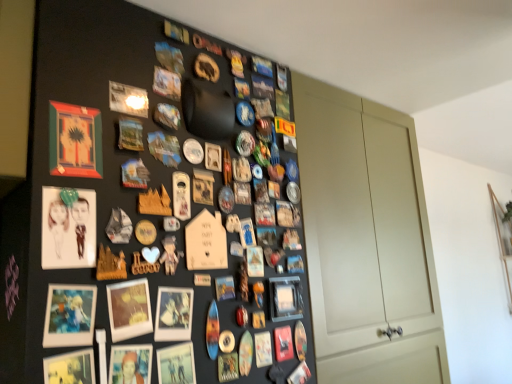
Describe the element at coordinates (75, 141) in the screenshot. I see `matte wooden picture frame at upper left, arranged as the first picture frame when viewed from the left` at that location.

Locate an element on the screen. matte wooden picture frame at upper left, arranged as the eighth picture frame when viewed from the right is located at coordinates (75, 141).

The width and height of the screenshot is (512, 384). Describe the element at coordinates (70, 315) in the screenshot. I see `matte plastic picture frame at lower left, which appears as the 6th picture frame when viewed from the right` at that location.

This screenshot has width=512, height=384. Find the location of `matte wooden picture frame at upper left, arranged as the eighth picture frame when viewed from the right`. matte wooden picture frame at upper left, arranged as the eighth picture frame when viewed from the right is located at coordinates pos(75,141).

Can you confirm if matte plastic picture frame at lower left, the 3th picture frame positioned from the left, is smaller than matte paper picture frame at left, the 7th picture frame in the right-to-left sequence?

Correct, matte plastic picture frame at lower left, the 3th picture frame positioned from the left, occupies less space than matte paper picture frame at left, the 7th picture frame in the right-to-left sequence.

Is matte paper picture frame at left, the 7th picture frame in the right-to-left sequence, inside matte plastic picture frame at lower left, which appears as the 6th picture frame when viewed from the right?

No, matte paper picture frame at left, the 7th picture frame in the right-to-left sequence, is not surrounded by matte plastic picture frame at lower left, which appears as the 6th picture frame when viewed from the right.

From the image's perspective, which picture frame is the 1st one below the matte paper picture frame at left, which is counted as the 2th picture frame, starting from the left? Please provide its 2D coordinates.

[(70, 315)]

In the scene shown: Is matte plastic picture frame at lower left, acting as the sixth picture frame starting from the left, not inside matte plastic picture frame at lower left, the 3th picture frame positioned from the left?

matte plastic picture frame at lower left, acting as the sixth picture frame starting from the left, lies outside matte plastic picture frame at lower left, the 3th picture frame positioned from the left,'s area.

From a real-world perspective, is matte plastic picture frame at lower left, which appears as the third picture frame when viewed from the right, positioned under matte plastic picture frame at lower left, the 3th picture frame positioned from the left, based on gravity?

Correct, in the physical world, matte plastic picture frame at lower left, which appears as the third picture frame when viewed from the right, is lower than matte plastic picture frame at lower left, the 3th picture frame positioned from the left.

Looking at their sizes, would you say matte plastic picture frame at lower left, acting as the sixth picture frame starting from the left, is wider or thinner than matte plastic picture frame at lower left, which appears as the 6th picture frame when viewed from the right?

Considering their sizes, matte plastic picture frame at lower left, acting as the sixth picture frame starting from the left, looks broader than matte plastic picture frame at lower left, which appears as the 6th picture frame when viewed from the right.

Considering the relative positions of matte plastic picture frame at lower left, which appears as the third picture frame when viewed from the right, and matte plastic picture frame at lower left, which appears as the 6th picture frame when viewed from the right, in the image provided, is matte plastic picture frame at lower left, which appears as the third picture frame when viewed from the right, to the right of matte plastic picture frame at lower left, which appears as the 6th picture frame when viewed from the right, from the viewer's perspective?

Yes, matte plastic picture frame at lower left, which appears as the third picture frame when viewed from the right, is to the right of matte plastic picture frame at lower left, which appears as the 6th picture frame when viewed from the right.

Would you say matte wooden picture frame at upper left, arranged as the eighth picture frame when viewed from the right, is outside matte black picture frame at lower right, the first picture frame in the right-to-left sequence?

Yes, matte wooden picture frame at upper left, arranged as the eighth picture frame when viewed from the right, is located beyond the bounds of matte black picture frame at lower right, the first picture frame in the right-to-left sequence.

Is the surface of matte wooden picture frame at upper left, arranged as the first picture frame when viewed from the left, in direct contact with matte black picture frame at lower right, the first picture frame in the right-to-left sequence?

No, matte wooden picture frame at upper left, arranged as the first picture frame when viewed from the left, is not beside matte black picture frame at lower right, the first picture frame in the right-to-left sequence.

Between matte wooden picture frame at upper left, arranged as the first picture frame when viewed from the left, and matte black picture frame at lower right, positioned as the 8th picture frame in left-to-right order, which one appears on the left side from the viewer's perspective?

Positioned to the left is matte wooden picture frame at upper left, arranged as the first picture frame when viewed from the left.

Locate an element on the screen. This screenshot has height=384, width=512. the 5th picture frame above the matte black picture frame at lower right, the first picture frame in the right-to-left sequence (from the image's perspective) is located at coordinates (75, 141).

Is matte black picture frame at lower right, the first picture frame in the right-to-left sequence, to the left or to the right of matte wooden picture frame at center, marked as the 5th picture frame in a left-to-right arrangement, in the image?

Based on their positions, matte black picture frame at lower right, the first picture frame in the right-to-left sequence, is located to the right of matte wooden picture frame at center, marked as the 5th picture frame in a left-to-right arrangement.

From a real-world perspective, who is located higher, matte black picture frame at lower right, positioned as the 8th picture frame in left-to-right order, or matte wooden picture frame at center, marked as the 5th picture frame in a left-to-right arrangement?

matte wooden picture frame at center, marked as the 5th picture frame in a left-to-right arrangement, from a real-world perspective.

Consider the image. From the image's perspective, which one is positioned lower, matte black picture frame at lower right, the first picture frame in the right-to-left sequence, or matte wooden picture frame at center, the fourth picture frame in the right-to-left sequence?

matte black picture frame at lower right, the first picture frame in the right-to-left sequence, from the image's perspective.

Considering the sizes of objects matte black picture frame at lower right, the first picture frame in the right-to-left sequence, and matte wooden picture frame at center, the fourth picture frame in the right-to-left sequence, in the image provided, who is thinner, matte black picture frame at lower right, the first picture frame in the right-to-left sequence, or matte wooden picture frame at center, the fourth picture frame in the right-to-left sequence,?

matte wooden picture frame at center, the fourth picture frame in the right-to-left sequence, is thinner.

Is point (95, 235) positioned behind point (54, 382)?

Yes, point (95, 235) is behind point (54, 382).

Is matte paper picture frame at left, the 7th picture frame in the right-to-left sequence, not within matte black picture frame at lower left, placed as the fourth picture frame when sorted from left to right?

Yes, matte paper picture frame at left, the 7th picture frame in the right-to-left sequence, is not within matte black picture frame at lower left, placed as the fourth picture frame when sorted from left to right.

Is matte paper picture frame at left, the 7th picture frame in the right-to-left sequence, oriented towards matte black picture frame at lower left, positioned as the fifth picture frame in right-to-left order?

No, matte paper picture frame at left, the 7th picture frame in the right-to-left sequence, is not turned towards matte black picture frame at lower left, positioned as the fifth picture frame in right-to-left order.

Who is more distant, matte paper picture frame at left, which is counted as the 2th picture frame, starting from the left, or matte black picture frame at lower left, placed as the fourth picture frame when sorted from left to right?

Positioned behind is matte paper picture frame at left, which is counted as the 2th picture frame, starting from the left.

From the image's perspective, which one is positioned lower, matte white door at center-right or matte white photo frame at center, the second picture frame viewed from the right?

matte white door at center-right.

You are a GUI agent. You are given a task and a screenshot of the screen. Output one action in this format:
    pyautogui.click(x=<x>, y=<y>)
    Task: Click on the 2nd picture frame to the left when counting from the matte white door at center-right
    The width and height of the screenshot is (512, 384).
    Given the screenshot: What is the action you would take?
    pyautogui.click(x=173, y=314)

Considering the relative sizes of matte white door at center-right and matte white photo frame at center, the second picture frame viewed from the right, in the image provided, is matte white door at center-right shorter than matte white photo frame at center, the second picture frame viewed from the right,?

No, matte white door at center-right is not shorter than matte white photo frame at center, the second picture frame viewed from the right.

From the picture: Between matte white door at center-right and matte white photo frame at center, the second picture frame viewed from the right, which one has smaller size?

With smaller size is matte white photo frame at center, the second picture frame viewed from the right.

Is matte white door at center-right shorter than matte paper picture frame at left, the 7th picture frame in the right-to-left sequence?

Incorrect, the height of matte white door at center-right does not fall short of that of matte paper picture frame at left, the 7th picture frame in the right-to-left sequence.

From the image's perspective, which one is positioned lower, matte white door at center-right or matte paper picture frame at left, which is counted as the 2th picture frame, starting from the left?

From the image's view, matte white door at center-right is below.

Looking at this image, can you tell me how much matte white door at center-right and matte paper picture frame at left, which is counted as the 2th picture frame, starting from the left, differ in facing direction?

The angular difference between matte white door at center-right and matte paper picture frame at left, which is counted as the 2th picture frame, starting from the left, is 1.85 degrees.

From a real-world perspective, starting from the matte plastic picture frame at lower left, the 3th picture frame positioned from the left, which picture frame is the 2nd one vertically above it? Please provide its 2D coordinates.

[(68, 228)]

Starting from the matte plastic picture frame at lower left, the 3th picture frame positioned from the left, which picture frame is the 2nd one behind? Please provide its 2D coordinates.

[(130, 364)]

From the image, which object appears to be nearer to matte plastic picture frame at lower left, the 3th picture frame positioned from the left, matte black picture frame at lower left, placed as the fourth picture frame when sorted from left to right, or matte black picture frame at lower right, the first picture frame in the right-to-left sequence?

Based on the image, matte black picture frame at lower left, placed as the fourth picture frame when sorted from left to right, appears to be nearer to matte plastic picture frame at lower left, the 3th picture frame positioned from the left.

Which object lies nearer to the anchor point matte black picture frame at lower right, positioned as the 8th picture frame in left-to-right order, matte black picture frame at lower left, positioned as the fifth picture frame in right-to-left order, or matte white photo frame at center, the seventh picture frame from the left?

matte white photo frame at center, the seventh picture frame from the left, lies closer to matte black picture frame at lower right, positioned as the 8th picture frame in left-to-right order, than the other object.

Considering their positions, is matte plastic picture frame at lower left, which appears as the 6th picture frame when viewed from the right, positioned further to matte wooden picture frame at center, the fourth picture frame in the right-to-left sequence, than matte white photo frame at center, the seventh picture frame from the left?

Based on the image, matte plastic picture frame at lower left, which appears as the 6th picture frame when viewed from the right, appears to be further to matte wooden picture frame at center, the fourth picture frame in the right-to-left sequence.

Based on their spatial positions, is matte white photo frame at center, the seventh picture frame from the left, or matte black picture frame at lower right, positioned as the 8th picture frame in left-to-right order, closer to matte plastic picture frame at lower left, which appears as the third picture frame when viewed from the right?

Among the two, matte white photo frame at center, the seventh picture frame from the left, is located nearer to matte plastic picture frame at lower left, which appears as the third picture frame when viewed from the right.

Estimate the real-world distances between objects in this image. Which object is further from matte black picture frame at lower right, the first picture frame in the right-to-left sequence, matte wooden picture frame at center, marked as the 5th picture frame in a left-to-right arrangement, or matte plastic picture frame at lower left, the 3th picture frame positioned from the left?

matte plastic picture frame at lower left, the 3th picture frame positioned from the left, is further to matte black picture frame at lower right, the first picture frame in the right-to-left sequence.

Looking at the image, which one is located closer to matte black picture frame at lower right, positioned as the 8th picture frame in left-to-right order, matte wooden picture frame at center, marked as the 5th picture frame in a left-to-right arrangement, or matte white photo frame at center, the seventh picture frame from the left?

matte white photo frame at center, the seventh picture frame from the left, lies closer to matte black picture frame at lower right, positioned as the 8th picture frame in left-to-right order, than the other object.

Looking at the image, which one is located closer to matte black picture frame at lower left, placed as the fourth picture frame when sorted from left to right, matte plastic picture frame at lower left, the 3th picture frame positioned from the left, or matte white door at center-right?

matte plastic picture frame at lower left, the 3th picture frame positioned from the left.

Consider the image. Based on their spatial positions, is matte black picture frame at lower left, placed as the fourth picture frame when sorted from left to right, or matte white door at center-right further from matte wooden picture frame at center, marked as the 5th picture frame in a left-to-right arrangement?

Among the two, matte white door at center-right is located further to matte wooden picture frame at center, marked as the 5th picture frame in a left-to-right arrangement.

Identify the location of picture frame between matte plastic picture frame at lower left, which appears as the third picture frame when viewed from the right, and matte black picture frame at lower right, positioned as the 8th picture frame in left-to-right order, in the horizontal direction. The height and width of the screenshot is (384, 512). (173, 314).

At what (x,y) coordinates should I click in order to perform the action: click on picture frame between matte paper picture frame at left, the 7th picture frame in the right-to-left sequence, and matte wooden picture frame at center, the fourth picture frame in the right-to-left sequence, from top to bottom. Please return your answer as a coordinate pair (x, y). Looking at the image, I should click on (70, 315).

The height and width of the screenshot is (384, 512). In order to click on picture frame between matte wooden picture frame at upper left, arranged as the first picture frame when viewed from the left, and matte plastic picture frame at lower left, the 3th picture frame positioned from the left, in the vertical direction in this screenshot , I will do `click(68, 228)`.

Identify the location of picture frame between matte white photo frame at center, the seventh picture frame from the left, and matte white door at center-right, in the horizontal direction. (285, 298).